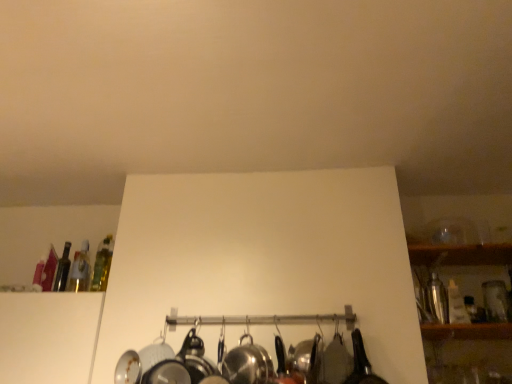
Question: Looking at their shapes, would you say shiny metallic shaker at right, the 4th bottle from the left, is wider or thinner than translucent glass bottle at upper left, which is counted as the fourth bottle, starting from the right?

Choices:
 (A) wide
 (B) thin

Answer: (A)

Question: Is shiny metallic shaker at right, arranged as the first bottle when viewed from the right, inside or outside of translucent glass bottle at upper left, arranged as the 1th bottle when viewed from the left?

Choices:
 (A) outside
 (B) inside

Answer: (A)

Question: Based on their relative distances, which object is farther from the translucent glass bottle at upper left, arranged as the 1th bottle when viewed from the left?

Choices:
 (A) polished stainless steel wok at center
 (B) shiny metallic shaker at right, the 4th bottle from the left
 (C) translucent glass bottle at left, which appears as the 3th bottle when viewed from the left
 (D) translucent glass bottle at upper left, which is the 2th bottle in left-to-right order

Answer: (B)

Question: Which is nearer to the translucent glass bottle at left, which appears as the 3th bottle when viewed from the left?

Choices:
 (A) polished stainless steel wok at center
 (B) shiny metallic shaker at right, arranged as the first bottle when viewed from the right
 (C) translucent glass bottle at upper left, which is the 2th bottle in left-to-right order
 (D) translucent glass bottle at upper left, arranged as the 1th bottle when viewed from the left

Answer: (C)